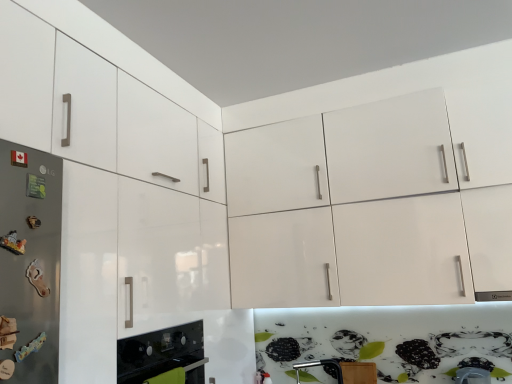
Question: Is glossy white cabinet at upper left to the left or to the right of metallic screwdriver at lower center in the image?

Choices:
 (A) left
 (B) right

Answer: (A)

Question: From the image's perspective, relative to metallic screwdriver at lower center, is glossy white cabinet at upper left above or below?

Choices:
 (A) below
 (B) above

Answer: (B)

Question: Estimate the real-world distances between objects in this image. Which object is farther from the glossy white cabinet at upper left?

Choices:
 (A) metallic screwdriver at lower center
 (B) black glass oven at lower left
 (C) satin silver refrigerator at left

Answer: (A)

Question: Which is nearer to the black glass oven at lower left?

Choices:
 (A) metallic screwdriver at lower center
 (B) glossy white cabinet at upper left
 (C) satin silver refrigerator at left

Answer: (B)